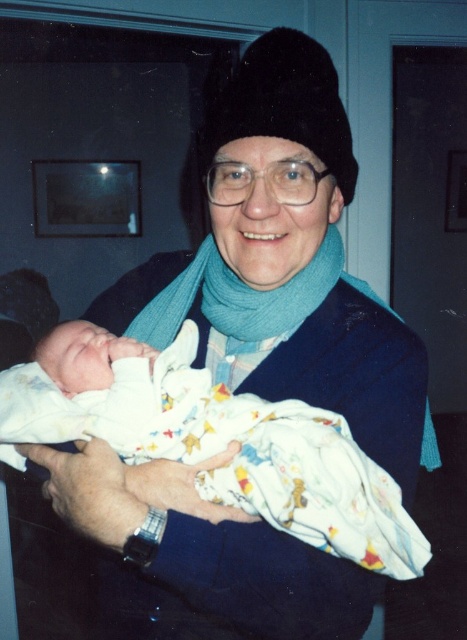
Between white cotton swaddle at center and teal soft scarf at center, which one appears on the right side from the viewer's perspective?

teal soft scarf at center is more to the right.

From the picture: Between white cotton swaddle at center and teal soft scarf at center, which one has less height?

Standing shorter between the two is teal soft scarf at center.

Is point (14, 467) positioned behind point (235, 294)?

Yes, point (14, 467) is behind point (235, 294).

Identify the location of white cotton swaddle at center. The image size is (467, 640). (213, 442).

How distant is white cotton swaddle at center from black fuzzy hat at center?

33.81 centimeters

Can you confirm if white cotton swaddle at center is positioned above black fuzzy hat at center?

No, white cotton swaddle at center is not above black fuzzy hat at center.

The height and width of the screenshot is (640, 467). What do you see at coordinates (213, 442) in the screenshot?
I see `white cotton swaddle at center` at bounding box center [213, 442].

Find the location of `white cotton swaddle at center`. white cotton swaddle at center is located at coordinates (213, 442).

The image size is (467, 640). What do you see at coordinates (284, 104) in the screenshot? I see `black fuzzy hat at center` at bounding box center [284, 104].

Is black fuzzy hat at center positioned behind teal soft scarf at center?

That is False.

What do you see at coordinates (284, 104) in the screenshot? I see `black fuzzy hat at center` at bounding box center [284, 104].

Where is `black fuzzy hat at center`? black fuzzy hat at center is located at coordinates (284, 104).